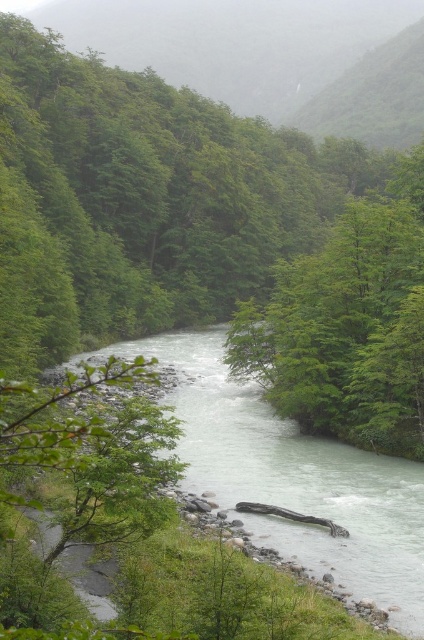
Is green leafy tree at center closer to the viewer compared to white smooth river at center?

No, it is behind white smooth river at center.

Which is behind, point (332, 230) or point (404, 570)?

The point (332, 230) is behind.

Locate an element on the screen. The width and height of the screenshot is (424, 640). green leafy tree at center is located at coordinates (348, 323).

Who is positioned more to the left, green leafy tree at center or green leafy forest at upper left?

From the viewer's perspective, green leafy tree at center appears more on the left side.

Who is more distant from viewer, (401, 188) or (409, 81)?

The point (409, 81) is more distant.

Locate an element on the screen. green leafy tree at center is located at coordinates (348, 323).

Who is more forward, (374, 100) or (128, 348)?

Point (128, 348)

The height and width of the screenshot is (640, 424). What do you see at coordinates (270, 56) in the screenshot? I see `green leafy forest at upper left` at bounding box center [270, 56].

This screenshot has width=424, height=640. Describe the element at coordinates (270, 56) in the screenshot. I see `green leafy forest at upper left` at that location.

Find the location of a particular element. green leafy forest at upper left is located at coordinates (270, 56).